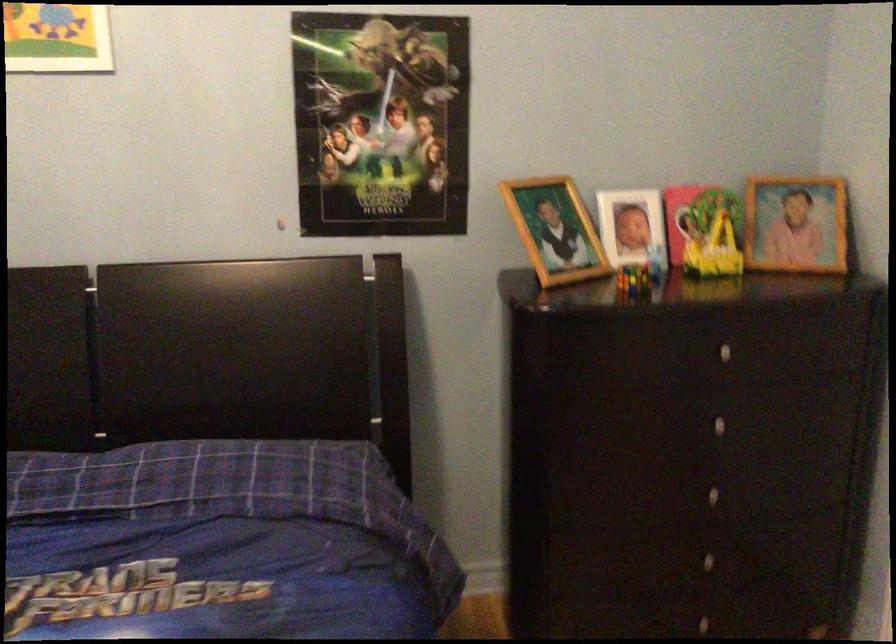
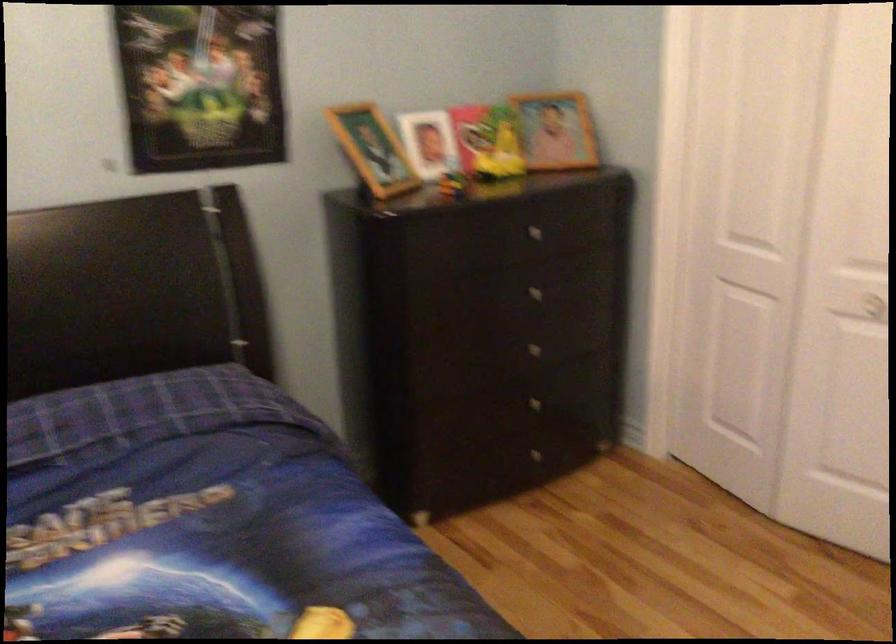
In the second image, find the point that corresponds to point 727,426 in the first image.

(538, 292)